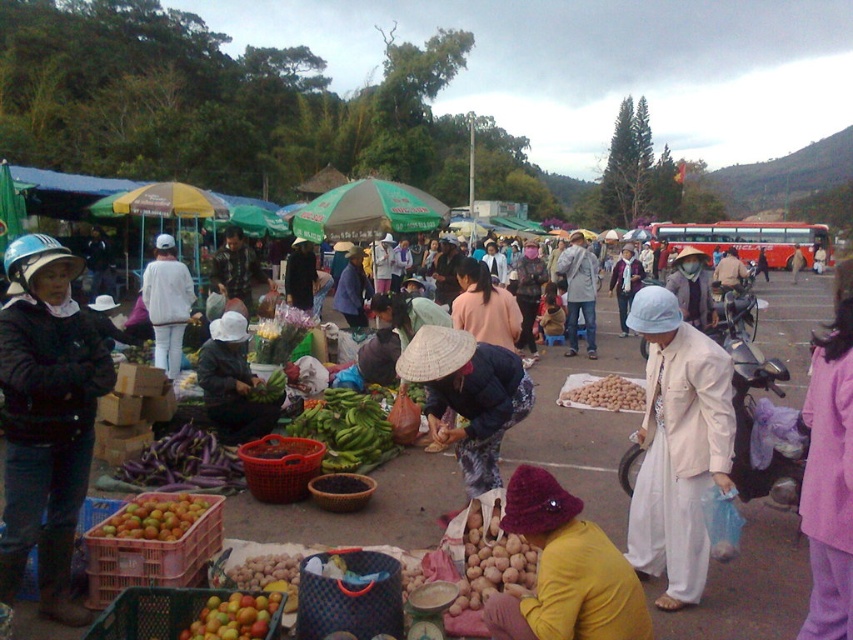
Question: Is green matte bananas at center to the right of matte pink shirt at center from the viewer's perspective?

Choices:
 (A) yes
 (B) no

Answer: (B)

Question: Which object is closer to the camera taking this photo?

Choices:
 (A) camouflage jacket at center
 (B) matte pink shirt at center
 (C) ripe tomato at center
 (D) purple smooth eggplant at lower left

Answer: (C)

Question: Is matte black jacket at left smaller than white cotton hat at center?

Choices:
 (A) yes
 (B) no

Answer: (A)

Question: Considering the relative positions of ripe tomato at center and white cotton hat at center in the image provided, where is ripe tomato at center located with respect to white cotton hat at center?

Choices:
 (A) right
 (B) left

Answer: (B)

Question: Among these objects, which one is farthest from the camera?

Choices:
 (A) white matte pants at center
 (B) white silk hat at center
 (C) orange matte fruit at lower left
 (D) yellow fabric hat at lower center

Answer: (A)

Question: Which object appears farthest from the camera in this image?

Choices:
 (A) yellow fabric hat at lower center
 (B) white matte pants at center
 (C) brown matte beans at center
 (D) ripe tomato at center

Answer: (B)